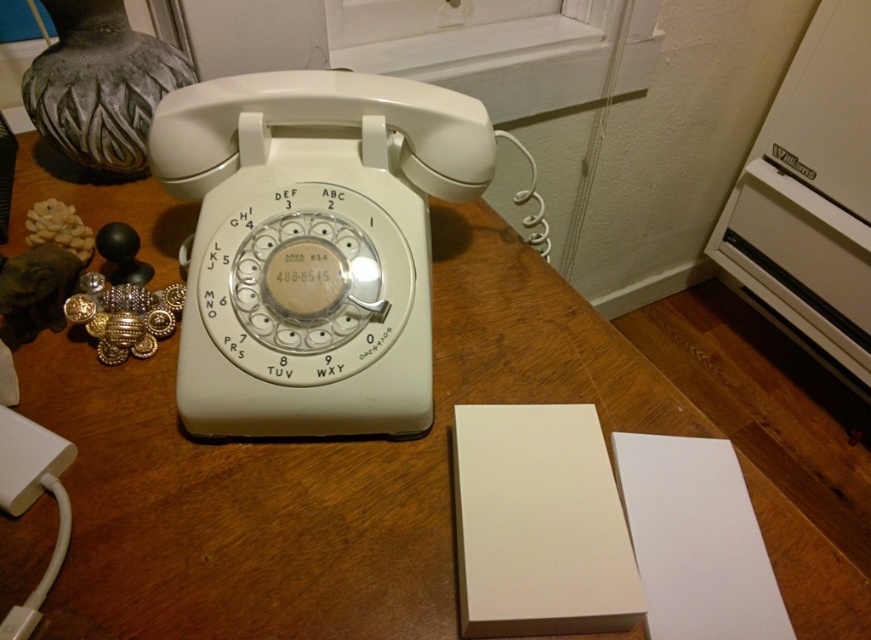
You are holding a camera and want to take a closeup photo of the vintage rotary dial telephone. The camera is currently positioned at point (274, 593). Based on the scene description, will the camera be close enough to capture the telephone clearly?

The point (274, 593) is 19.73 inches away from the camera, so yes, the camera is close enough to capture the vintage rotary dial telephone clearly as the distance is within a typical closeup range.

You are standing in front of a white wood table at center. You want to place a 30 cm wide book on it. Is there enough space?

The white wood table at center and viewer are 44.27 centimeters apart. Since the book is 30 cm wide, it will fit as long as the table has sufficient space. However, the exact dimensions of the table aren

From the picture: You have a small decorative sculpture that needs to be placed on the white wood table at center or the white plastic rotary phone at center. Which surface can accommodate it better based on their sizes?

The white wood table at center is larger in size than the white plastic rotary phone at center, so the sculpture will fit better on the white wood table at center.